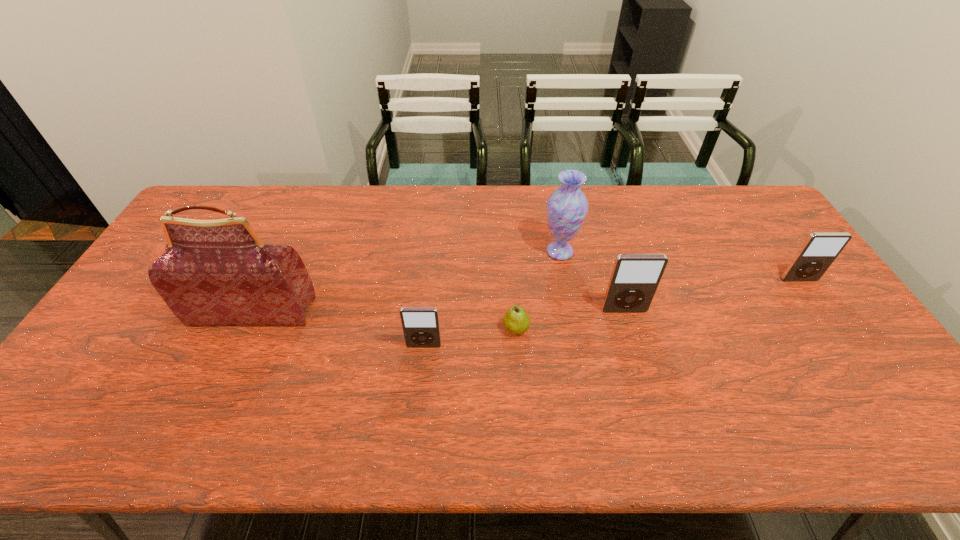
The width and height of the screenshot is (960, 540). In order to click on free spot at the near edge of the desktop in this screenshot , I will do `click(560, 371)`.

The height and width of the screenshot is (540, 960). What are the coordinates of `free space at the left edge` in the screenshot? It's located at (148, 319).

This screenshot has width=960, height=540. In the image, there is a desktop. Identify the location of free region at the right edge. (782, 248).

Identify the location of vacant space at the far left corner of the desktop. (250, 189).

You are a GUI agent. You are given a task and a screenshot of the screen. Output one action in this format:
    pyautogui.click(x=<x>, y=<y>)
    Task: Click on the free space at the near left corner of the desktop
    
    Given the screenshot: What is the action you would take?
    pyautogui.click(x=63, y=392)

Where is `vacant space at the far right corner of the desktop`? The width and height of the screenshot is (960, 540). vacant space at the far right corner of the desktop is located at coordinates (754, 197).

Identify the location of free space between the fourth object from right to left and the second iPod from left to right. (570, 320).

Identify the location of vacant space that is in between the leftmost iPod and the third object from right to left. (492, 299).

Find the location of a particular element. free space between the handbag and the second object from right to left is located at coordinates tap(439, 312).

The height and width of the screenshot is (540, 960). I want to click on free space between the fifth nearest object and the handbag, so click(526, 296).